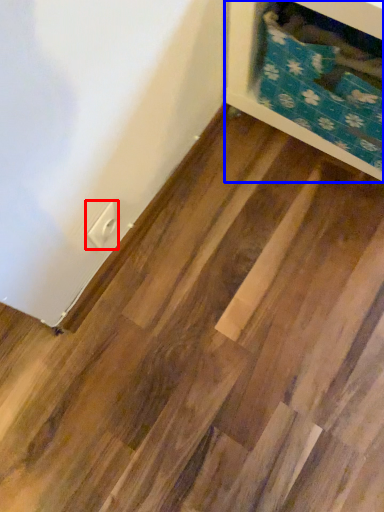
Question: Which object is closer to the camera taking this photo, electric outlet (highlighted by a red box) or furniture (highlighted by a blue box)?

Choices:
 (A) electric outlet
 (B) furniture

Answer: (B)